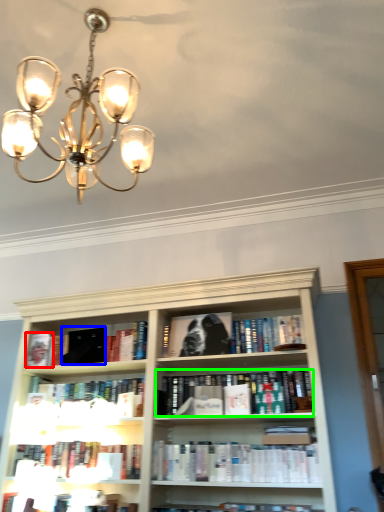
Question: Estimate the real-world distances between objects in this image. Which object is closer to paperback book (highlighted by a red box), paperback book (highlighted by a blue box) or book (highlighted by a green box)?

Choices:
 (A) paperback book
 (B) book

Answer: (A)